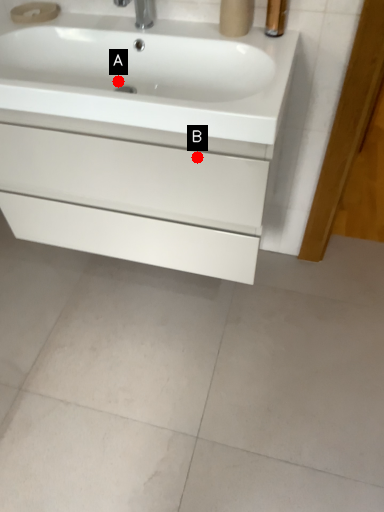
Question: Two points are circled on the image, labeled by A and B beside each circle. Which point is closer to the camera?

Choices:
 (A) A is closer
 (B) B is closer

Answer: (B)